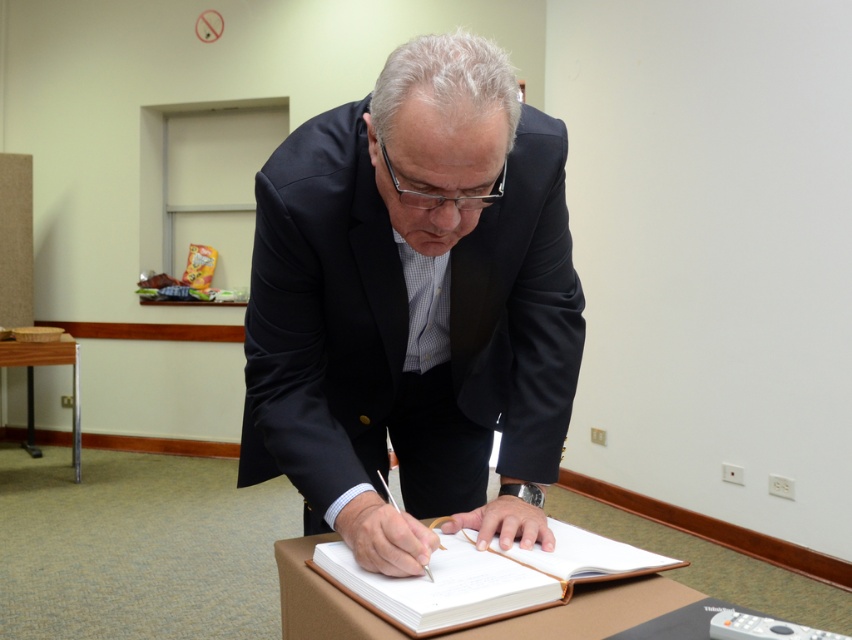
Does black satin suit at center appear on the left side of metallic silver table at lower left?

Incorrect, black satin suit at center is not on the left side of metallic silver table at lower left.

Where is `black satin suit at center`? The height and width of the screenshot is (640, 852). black satin suit at center is located at coordinates (413, 304).

Is leather-bound notebook at center behind metallic silver table at lower left?

No, it is in front of metallic silver table at lower left.

Between leather-bound notebook at center and metallic silver table at lower left, which one has less height?

leather-bound notebook at center is shorter.

Identify the location of leather-bound notebook at center. (484, 577).

Which is more to the left, black satin suit at center or leather-bound notebook at center?

From the viewer's perspective, black satin suit at center appears more on the left side.

Does point (263, 410) come behind point (648, 561)?

Yes, it is behind point (648, 561).

This screenshot has width=852, height=640. Find the location of `black satin suit at center`. black satin suit at center is located at coordinates (413, 304).

What are the coordinates of `black satin suit at center` in the screenshot? It's located at (413, 304).